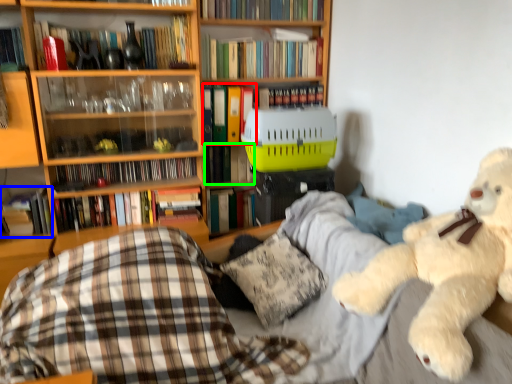
Question: Which is farther away from book (highlighted by a red box)? book (highlighted by a blue box) or book (highlighted by a green box)?

Choices:
 (A) book
 (B) book

Answer: (A)